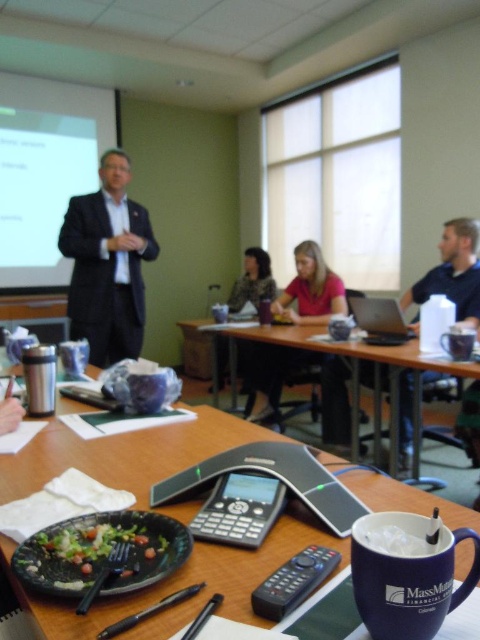
You are attending a professional meeting and need to choose between the black suit at center and the matte pink shirt at center for your outfit. Based on their positions on the table, which one is located to the left?

The black suit at center is positioned on the left side of the matte pink shirt at center, so the black suit at center is located to the left.

You are an office assistant who needs to place a 10 feet long banner between the black suit at center and the blue ceramic mug at lower right. Is there enough space between them to fit the banner?

The distance between the black suit at center and the blue ceramic mug at lower right is 8.49 feet, which is shorter than the 10 feet banner. Therefore, the banner cannot be placed between them.

You are organizing a meeting in the conference room and need to place a new document holder on the wooden table at center. Where should you position it so it doesn not block the satin silver laptop at center?

The wooden table at center is located below the satin silver laptop at center, so positioning the document holder on the lower part of the wooden table at center would avoid blocking the laptop.